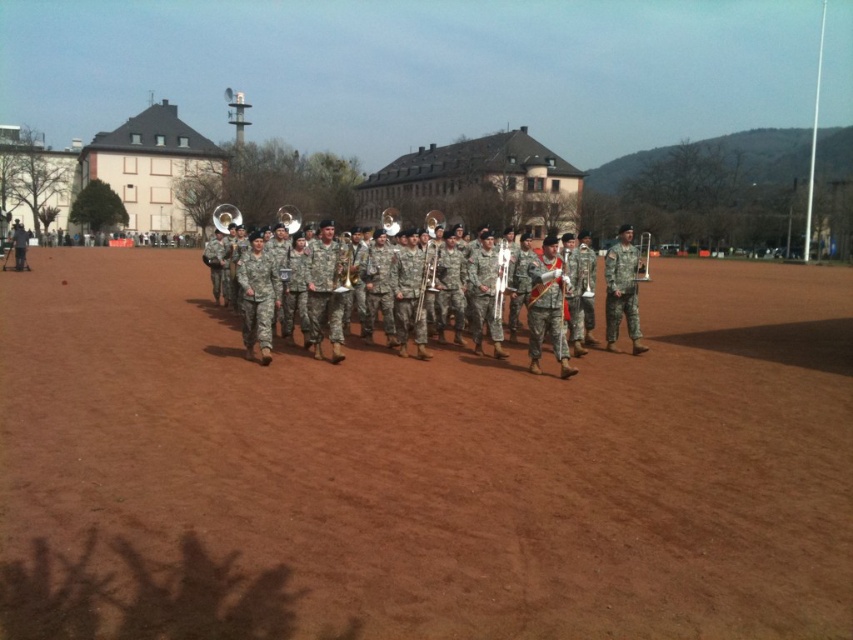
You are a photographer planning to capture the entire scene of the military band on the brown dirt field at center and the camouflage fabric band at center. Based on their widths, which object should you focus on to ensure both are fully visible in the frame?

The brown dirt field at center has a lesser width compared to camouflage fabric band at center, so you should focus on the camouflage fabric band at center to ensure both objects are fully visible in the frame since it is wider and will help frame the scene appropriately.

You are a photographer positioned at the edge of the brown dirt field at center and want to capture the silver metallic trombone at center in your shot. Which direction should you move to get the trombone into your frame?

The brown dirt field at center is to the left of the silver metallic trombone at center, so you should move to your right to position the trombone within your frame.

You are a photographer trying to capture a clear shot of both the camouflage fabric band at center and the silver metallic trombone at center. Based on their heights, which object should you focus on first to ensure it doesn t get obscured by the other?

The camouflage fabric band at center is taller than the silver metallic trombone at center. Therefore, you should focus on the camouflage fabric band at center first to prevent it from obscuring the trombone in your shot.